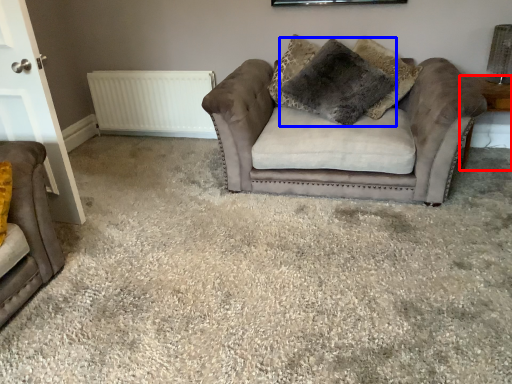
Question: Among these objects, which one is nearest to the camera, side table (highlighted by a red box) or pillow (highlighted by a blue box)?

Choices:
 (A) side table
 (B) pillow

Answer: (B)